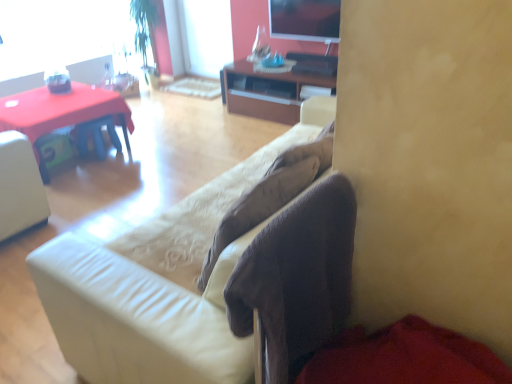
Question: From the image's perspective, is suede-like beige couch at center located above or below matte plastic desk at left?

Choices:
 (A) above
 (B) below

Answer: (B)

Question: From a real-world perspective, relative to matte plastic desk at left, is suede-like beige couch at center vertically above or below?

Choices:
 (A) above
 (B) below

Answer: (A)

Question: Considering the real-world distances, which object is closest to the suede-like beige couch at center?

Choices:
 (A) brown wood cabinet at center
 (B) matte plastic desk at left
 (C) matte black tv at upper center

Answer: (B)

Question: Which object is the closest to the matte plastic desk at left?

Choices:
 (A) matte black tv at upper center
 (B) brown wood cabinet at center
 (C) suede-like beige couch at center

Answer: (B)